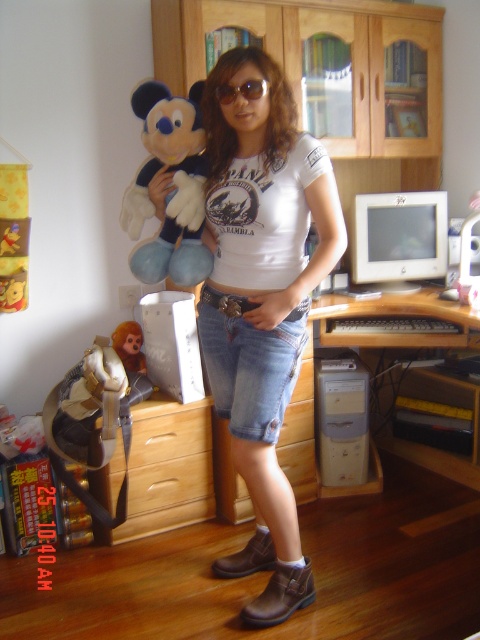
Please provide the 2D coordinates of the soft plush toy at upper left in the image. The coordinates should be in the format of a point with two decimal places separated by a comma, like this example format point_x, point_y. The scene is a person standing indoors in a personal workspace or bedroom with wooden furniture, holding a large plush toy. The room includes a wooden cabinet with glass doors, a desk with a computer monitor, and a small wooden dresser with a figurine on top. The soft plush toy at upper.

The 2D coordinates of the soft plush toy at upper left are at point (172, 186).

You are organizing a desk and need to place a new item between the white plastic computer tower at lower center and the gold metallic sunglasses at center. Based on their positions, which object should you place the new item closer to if you want it to be on the left side of the desk?

The gold metallic sunglasses at center are to the left of the white plastic computer tower at lower center. To place the new item on the left side of the desk, position it closer to the gold metallic sunglasses at center.